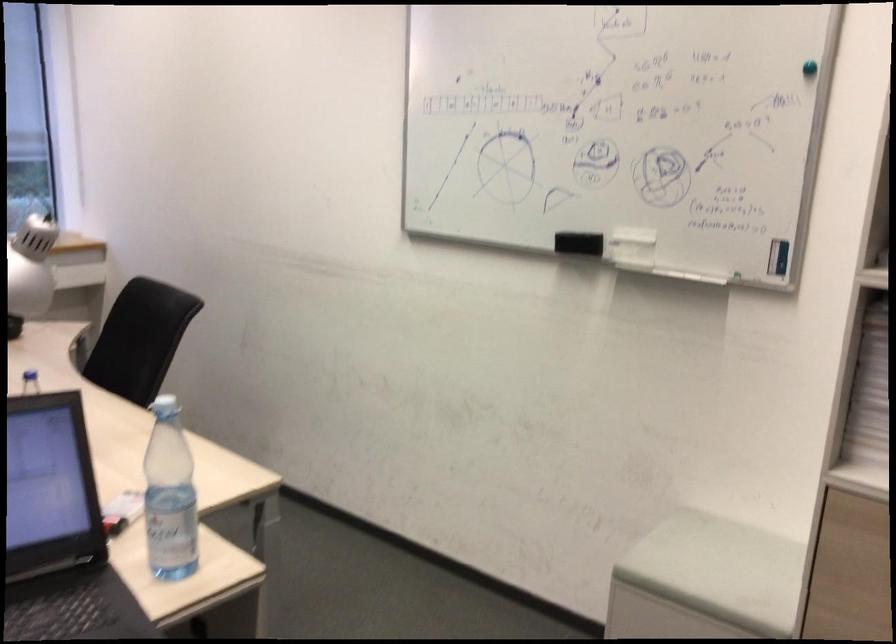
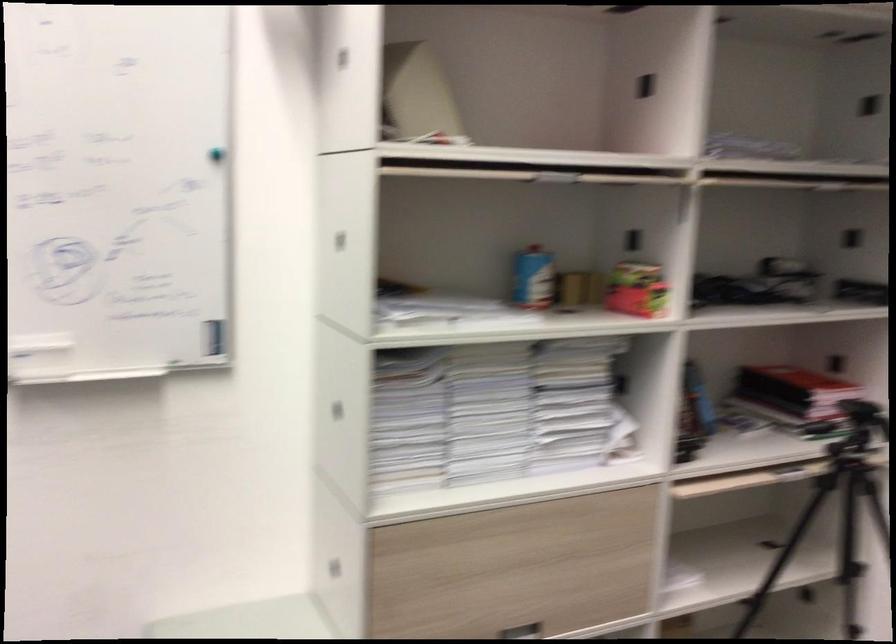
Question: The camera is either moving clockwise (left) or counter-clockwise (right) around the object. The first image is from the beginning of the video and the second image is from the end. Is the camera moving left or right when shooting the video?

Choices:
 (A) Left
 (B) Right

Answer: (A)